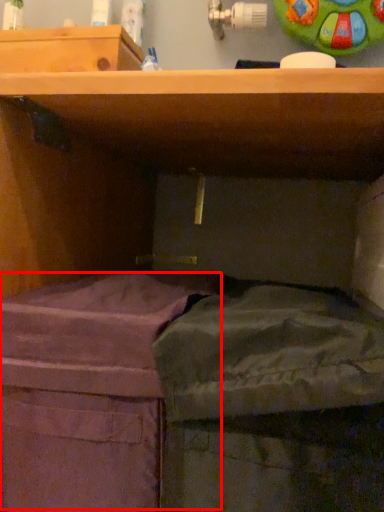
Question: From the image's perspective, what is the correct spatial positioning of wide (annotated by the red box) in reference to wide?

Choices:
 (A) above
 (B) below

Answer: (B)